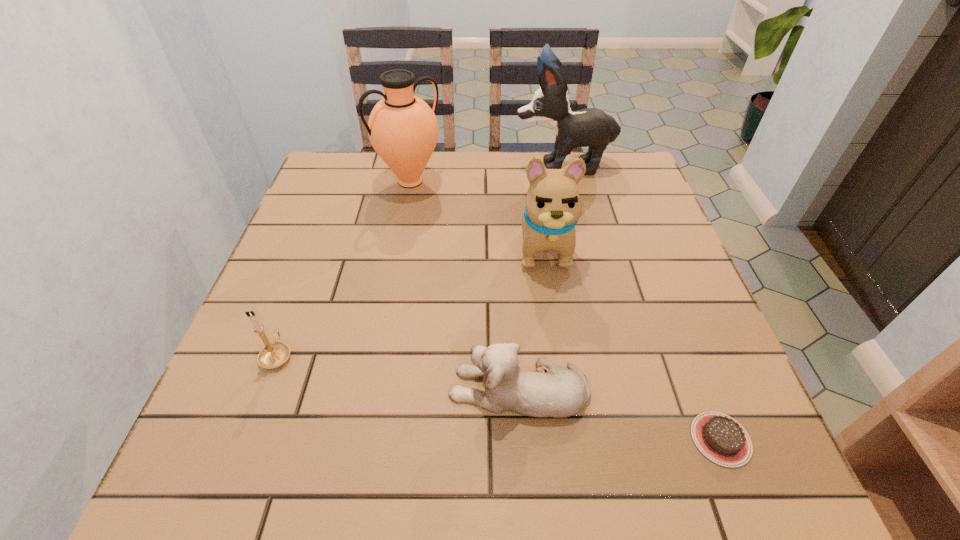
The height and width of the screenshot is (540, 960). Identify the location of free location that satisfies the following two spatial constraints: 1. on the front-facing side of the chocolate cake; 2. on the left side of the tallest puppy. (628, 439).